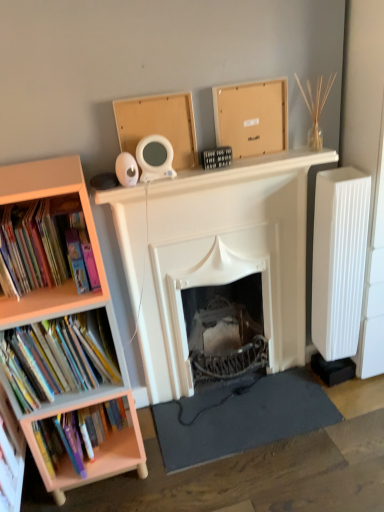
You are a GUI agent. You are given a task and a screenshot of the screen. Output one action in this format:
    pyautogui.click(x=<x>, y=<y>)
    Task: Click on the vacant point above dark gray rubber mat at lower center (from a real-world perspective)
    This screenshot has height=512, width=384.
    Given the screenshot: What is the action you would take?
    pyautogui.click(x=240, y=408)